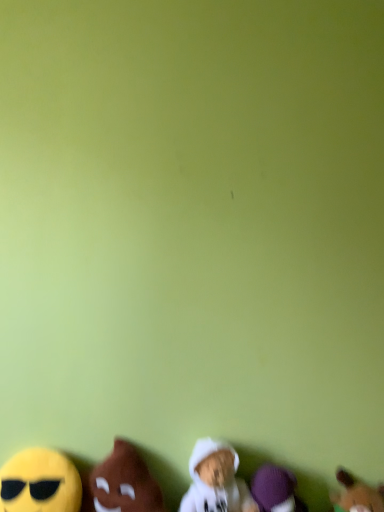
Question: Does purple plush toy at lower right, which is counted as the 4th toy, starting from the left, have a lesser width compared to white plush toy at lower center, positioned as the 3th toy in left-to-right order?

Choices:
 (A) yes
 (B) no

Answer: (A)

Question: Is purple plush toy at lower right, which is counted as the 4th toy, starting from the left, in contact with white plush toy at lower center, positioned as the 3th toy in left-to-right order?

Choices:
 (A) yes
 (B) no

Answer: (B)

Question: Is purple plush toy at lower right, which ranks as the second toy in right-to-left order, aimed at white plush toy at lower center, which is the third toy from right to left?

Choices:
 (A) yes
 (B) no

Answer: (B)

Question: Does purple plush toy at lower right, which is counted as the 4th toy, starting from the left, lie behind white plush toy at lower center, positioned as the 3th toy in left-to-right order?

Choices:
 (A) no
 (B) yes

Answer: (B)

Question: Can you confirm if purple plush toy at lower right, which is counted as the 4th toy, starting from the left, is shorter than white plush toy at lower center, positioned as the 3th toy in left-to-right order?

Choices:
 (A) yes
 (B) no

Answer: (A)

Question: Looking at their shapes, would you say brown plush toy at lower right, positioned as the 1th toy in right-to-left order, is wider or thinner than purple plush toy at lower right, which is counted as the 4th toy, starting from the left?

Choices:
 (A) thin
 (B) wide

Answer: (B)

Question: From the image's perspective, relative to purple plush toy at lower right, which ranks as the second toy in right-to-left order, is brown plush toy at lower right, the fifth toy in the left-to-right sequence, above or below?

Choices:
 (A) below
 (B) above

Answer: (A)

Question: From their relative heights in the image, would you say brown plush toy at lower right, positioned as the 1th toy in right-to-left order, is taller or shorter than purple plush toy at lower right, which is counted as the 4th toy, starting from the left?

Choices:
 (A) short
 (B) tall

Answer: (A)

Question: Based on their positions, is brown plush toy at lower right, positioned as the 1th toy in right-to-left order, located to the left or right of purple plush toy at lower right, which ranks as the second toy in right-to-left order?

Choices:
 (A) right
 (B) left

Answer: (A)

Question: From their relative heights in the image, would you say brown plush toy at lower left, the second toy viewed from the left, is taller or shorter than brown plush toy at lower right, the fifth toy in the left-to-right sequence?

Choices:
 (A) tall
 (B) short

Answer: (A)

Question: In the image, is brown plush toy at lower left, acting as the 4th toy starting from the right, on the left side or the right side of brown plush toy at lower right, the fifth toy in the left-to-right sequence?

Choices:
 (A) right
 (B) left

Answer: (B)

Question: From the image's perspective, is brown plush toy at lower left, the second toy viewed from the left, above or below brown plush toy at lower right, positioned as the 1th toy in right-to-left order?

Choices:
 (A) below
 (B) above

Answer: (B)

Question: In terms of width, does brown plush toy at lower left, acting as the 4th toy starting from the right, look wider or thinner when compared to brown plush toy at lower right, positioned as the 1th toy in right-to-left order?

Choices:
 (A) wide
 (B) thin

Answer: (A)

Question: Is brown plush toy at lower right, positioned as the 1th toy in right-to-left order, spatially inside white plush toy at lower center, which is the third toy from right to left, or outside of it?

Choices:
 (A) inside
 (B) outside

Answer: (B)

Question: From their relative heights in the image, would you say brown plush toy at lower right, positioned as the 1th toy in right-to-left order, is taller or shorter than white plush toy at lower center, which is the third toy from right to left?

Choices:
 (A) tall
 (B) short

Answer: (B)